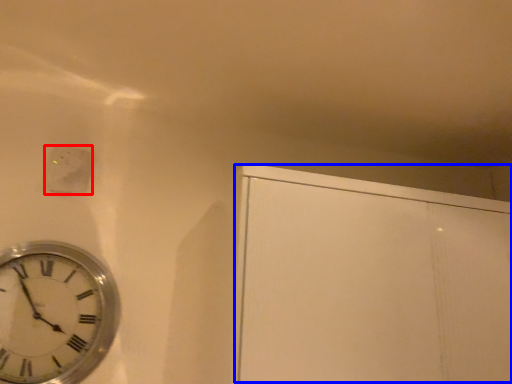
Question: Which of the following is the closest to the observer, electric outlet (highlighted by a red box) or glass door (highlighted by a blue box)?

Choices:
 (A) electric outlet
 (B) glass door

Answer: (B)